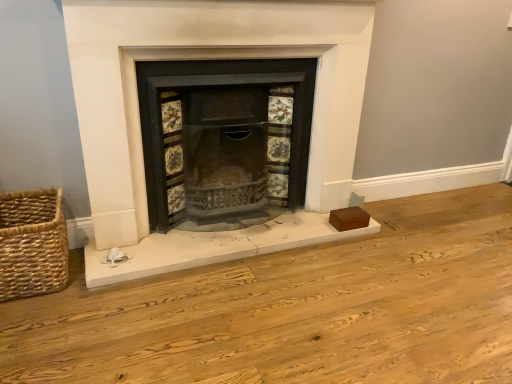
Question: Is black cast iron wood burning stove at center inside the boundaries of matte black fireplace at center, or outside?

Choices:
 (A) inside
 (B) outside

Answer: (A)

Question: Does point (227, 84) appear closer or farther from the camera than point (163, 254)?

Choices:
 (A) farther
 (B) closer

Answer: (A)

Question: Considering the real-world distances, which object is closest to the woven straw basket at lower left?

Choices:
 (A) matte black fireplace at center
 (B) black cast iron wood burning stove at center

Answer: (A)

Question: Based on their relative distances, which object is nearer to the matte black fireplace at center?

Choices:
 (A) black cast iron wood burning stove at center
 (B) woven straw basket at lower left

Answer: (A)